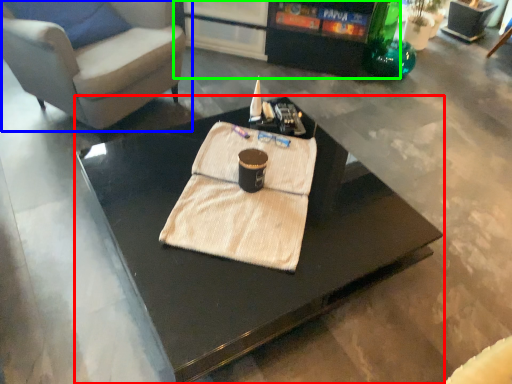
Question: Which object is the farthest from coffee table (highlighted by a red box)? Choose among these: chair (highlighted by a blue box) or entertainment center (highlighted by a green box).

Choices:
 (A) chair
 (B) entertainment center

Answer: (B)